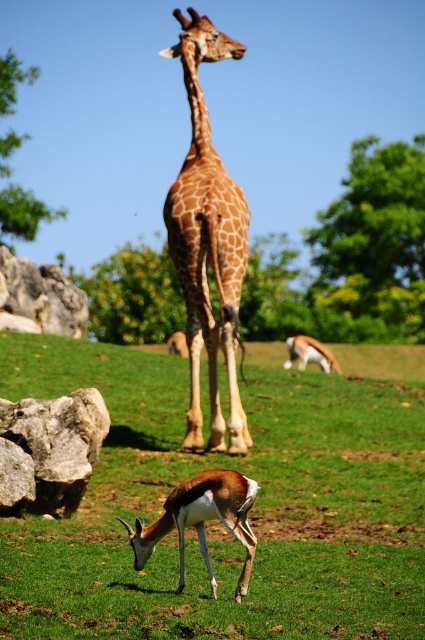
Question: Which object is positioned closest to the green grass at center?

Choices:
 (A) spotted brown giraffe at center
 (B) gray rough rock at lower left

Answer: (B)

Question: Does shiny brown antelope at lower center have a larger size compared to white glossy antelope at lower center?

Choices:
 (A) yes
 (B) no

Answer: (A)

Question: Does gray rough rock at lower left have a lesser width compared to shiny brown antelope at lower center?

Choices:
 (A) yes
 (B) no

Answer: (B)

Question: Where is green grass at center located in relation to gray rough rock at lower left in the image?

Choices:
 (A) below
 (B) above

Answer: (A)

Question: Which point is closer to the camera?

Choices:
 (A) (206, 138)
 (B) (19, 451)

Answer: (B)

Question: Which of the following is the closest to the observer?

Choices:
 (A) (x=218, y=504)
 (B) (x=316, y=340)

Answer: (A)